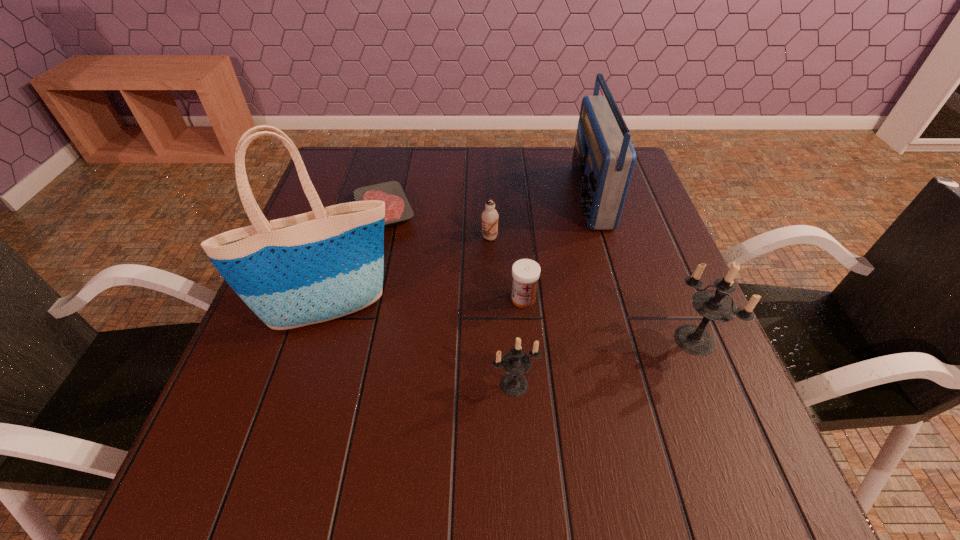
This screenshot has height=540, width=960. In the image, there is a desktop. What are the coordinates of `blank space at the far right corner` in the screenshot? It's located at (640, 186).

The height and width of the screenshot is (540, 960). In the image, there is a desktop. In order to click on free region at the near right corner in this screenshot , I will do click(x=688, y=429).

I want to click on free spot between the medicine and the taller candle holder, so click(x=609, y=319).

I want to click on free space between the medicine and the third shortest object, so click(507, 268).

Image resolution: width=960 pixels, height=540 pixels. In order to click on empty location between the medicine and the taller candle holder in this screenshot , I will do `click(609, 319)`.

The width and height of the screenshot is (960, 540). I want to click on free space between the nearer candle holder and the right candle holder, so click(605, 362).

The width and height of the screenshot is (960, 540). Find the location of `unoccupied area between the second shortest object and the chocolate milk`. unoccupied area between the second shortest object and the chocolate milk is located at coordinates (507, 268).

The height and width of the screenshot is (540, 960). What are the coordinates of `free space between the radio receiver and the right candle holder` in the screenshot? It's located at (642, 268).

I want to click on free point between the fourth shortest object and the shortest object, so click(x=449, y=297).

Where is `free space between the sixth object from left to right and the shorter candle holder`? This screenshot has width=960, height=540. free space between the sixth object from left to right and the shorter candle holder is located at coordinates (552, 290).